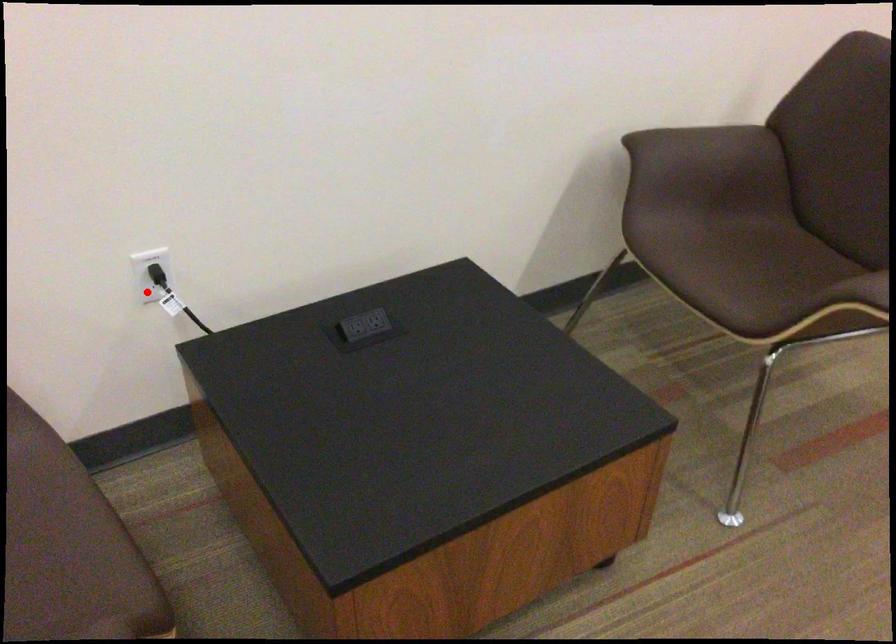
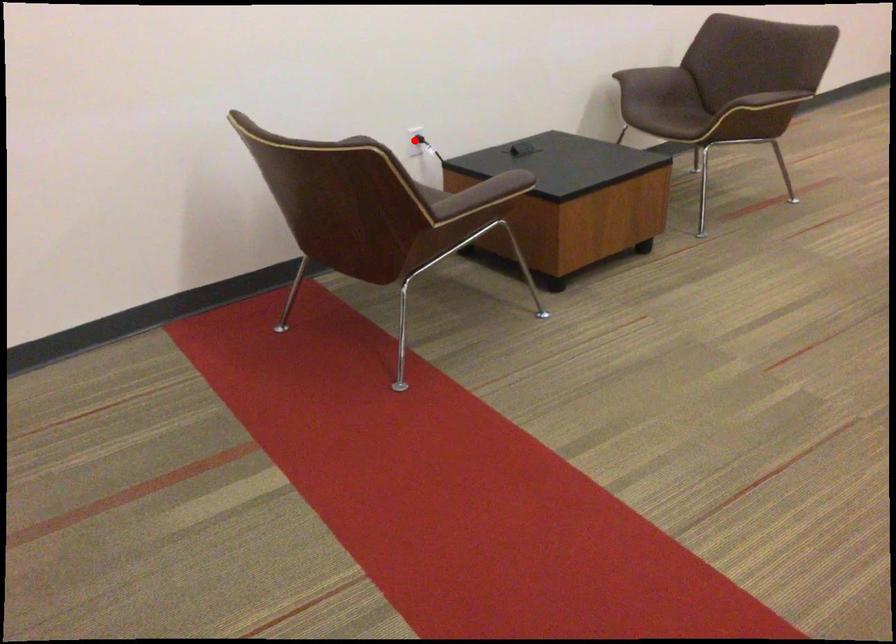
I am providing you with two images of the same scene from different viewpoints. A red point is marked on the first image and another point is marked on the second image. Is the red point in image1 aligned with the point shown in image2?

Yes